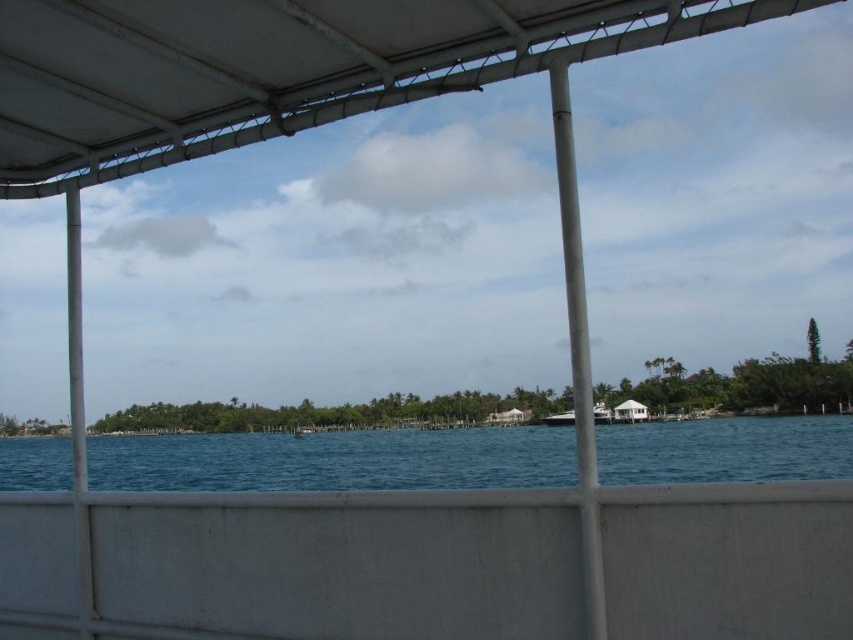
Looking at this image, you are standing on the boat deck and want to know how far the point at coordinates (404, 484) is from your current position. Can you determine the distance?

The point at coordinates (404, 484) is 44.40 meters away from your current position on the boat deck.

You are standing on the boat deck and want to take a photo of the blue water at center. According to the coordinates provided, in which direction should you point your camera relative to your current position?

The blue water at center is located at coordinates point (x=335, y=460). Since the x coordinate is 0.720, which is to the right of the center point, and the y coordinate is 0.394, which is above the center point, you should point your camera slightly to the right and upwards from your current position to capture the blue water at center.